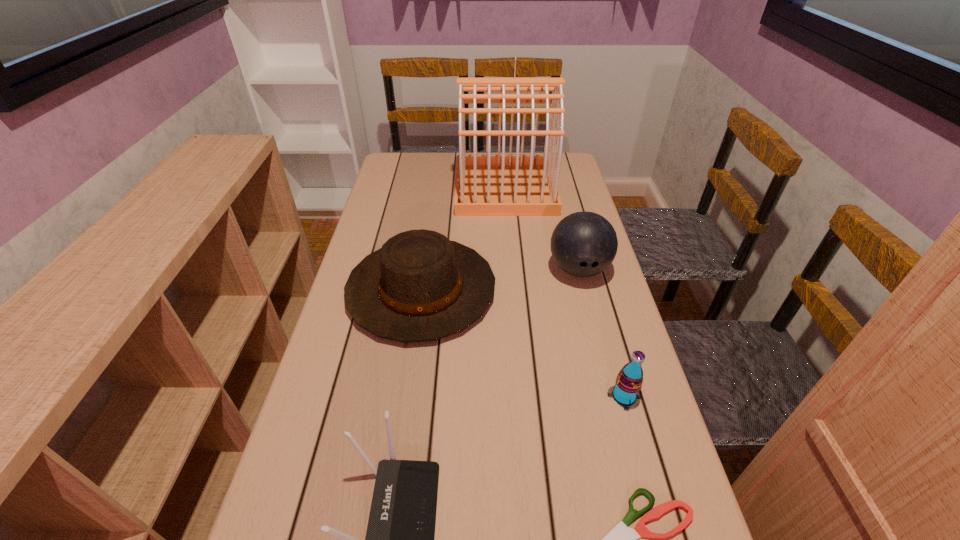
Where is `free space located 0.100m on the front of the soda`? The width and height of the screenshot is (960, 540). free space located 0.100m on the front of the soda is located at coordinates coord(640,456).

You are a GUI agent. You are given a task and a screenshot of the screen. Output one action in this format:
    pyautogui.click(x=<x>, y=<y>)
    Task: Click on the object that is positioned at the far edge
    This screenshot has width=960, height=540.
    Given the screenshot: What is the action you would take?
    pyautogui.click(x=486, y=185)

In order to click on object positioned at the left edge in this screenshot , I will do `click(420, 286)`.

Identify the location of birdcage that is at the right edge. [486, 185].

Locate an element on the screen. bowling ball that is at the right edge is located at coordinates (583, 244).

The image size is (960, 540). What are the coordinates of `soda at the right edge` in the screenshot? It's located at (627, 389).

Locate an element on the screen. The image size is (960, 540). object situated at the far right corner is located at coordinates (486, 185).

In the image, there is a desktop. Identify the location of vacant space at the far edge. The height and width of the screenshot is (540, 960). (447, 161).

You are a GUI agent. You are given a task and a screenshot of the screen. Output one action in this format:
    pyautogui.click(x=<x>, y=<y>)
    Task: Click on the free space at the left edge of the desktop
    The image size is (960, 540).
    Given the screenshot: What is the action you would take?
    pyautogui.click(x=306, y=504)

I want to click on free space at the right edge of the desktop, so pos(604,339).